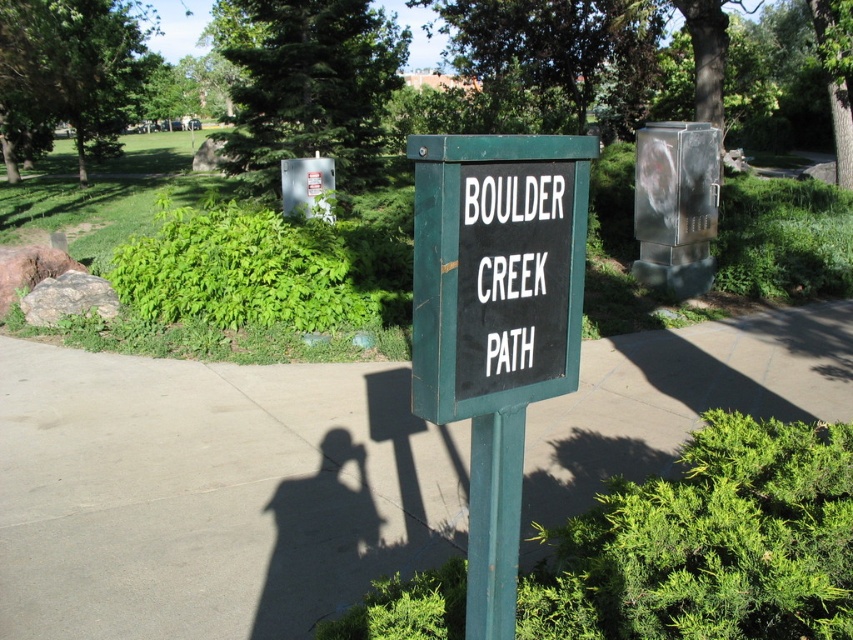
You are standing at the park and see the gray concrete pavement at center and the black plastic sign at center. Which object is located higher from the ground?

The black plastic sign at center is higher from the ground than the gray concrete pavement at center because the gray concrete pavement at center is below the black plastic sign at center.

You are a hiker who wants to read the signs clearly. Which of the two signs, the green matte sign at center or the black plastic sign at center, would you look up higher to read?

The green matte sign at center is much taller than the black plastic sign at center, so you would need to look up higher to read the green matte sign at center.